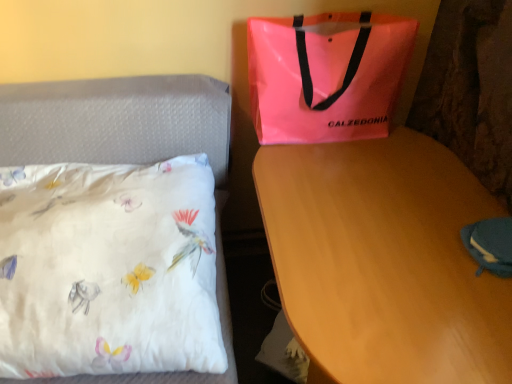
Where is `free region on the left part of blue fabric pouch at lower right`? free region on the left part of blue fabric pouch at lower right is located at coordinates (424, 249).